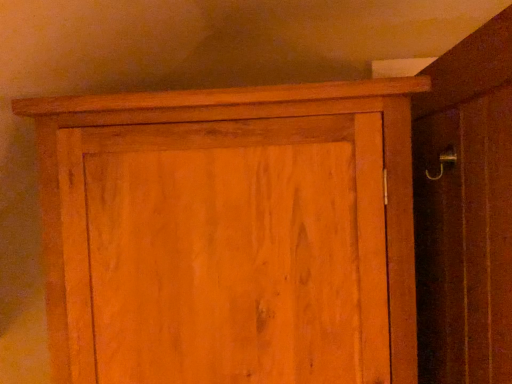
Question: Is wooden cupboard at upper center far from wooden screen door at right?

Choices:
 (A) no
 (B) yes

Answer: (A)

Question: Is wooden cupboard at upper center further to camera compared to wooden screen door at right?

Choices:
 (A) yes
 (B) no

Answer: (A)

Question: Is the depth of wooden cupboard at upper center less than that of wooden screen door at right?

Choices:
 (A) no
 (B) yes

Answer: (A)

Question: Would you say wooden cupboard at upper center contains wooden screen door at right?

Choices:
 (A) yes
 (B) no

Answer: (B)

Question: Considering the relative sizes of wooden cupboard at upper center and wooden screen door at right in the image provided, is wooden cupboard at upper center smaller than wooden screen door at right?

Choices:
 (A) no
 (B) yes

Answer: (A)

Question: Is wooden cupboard at upper center to the left of wooden screen door at right from the viewer's perspective?

Choices:
 (A) yes
 (B) no

Answer: (A)

Question: From the image's perspective, is wooden screen door at right on wooden cupboard at upper center?

Choices:
 (A) no
 (B) yes

Answer: (B)

Question: Could you tell me if wooden screen door at right is turned towards wooden cupboard at upper center?

Choices:
 (A) yes
 (B) no

Answer: (A)

Question: Could wooden cupboard at upper center be considered to be inside wooden screen door at right?

Choices:
 (A) no
 (B) yes

Answer: (A)

Question: Is wooden screen door at right further to camera compared to wooden cupboard at upper center?

Choices:
 (A) yes
 (B) no

Answer: (B)

Question: Considering the relative positions of wooden screen door at right and wooden cupboard at upper center in the image provided, is wooden screen door at right to the left of wooden cupboard at upper center from the viewer's perspective?

Choices:
 (A) yes
 (B) no

Answer: (B)

Question: Is wooden screen door at right positioned in front of wooden cupboard at upper center?

Choices:
 (A) yes
 (B) no

Answer: (A)

Question: Based on their positions, is wooden screen door at right located to the left or right of wooden cupboard at upper center?

Choices:
 (A) right
 (B) left

Answer: (A)